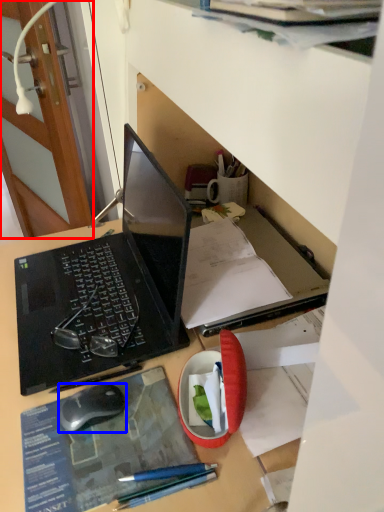
Question: Among these objects, which one is farthest to the camera, door (highlighted by a red box) or computer mouse (highlighted by a blue box)?

Choices:
 (A) door
 (B) computer mouse

Answer: (A)